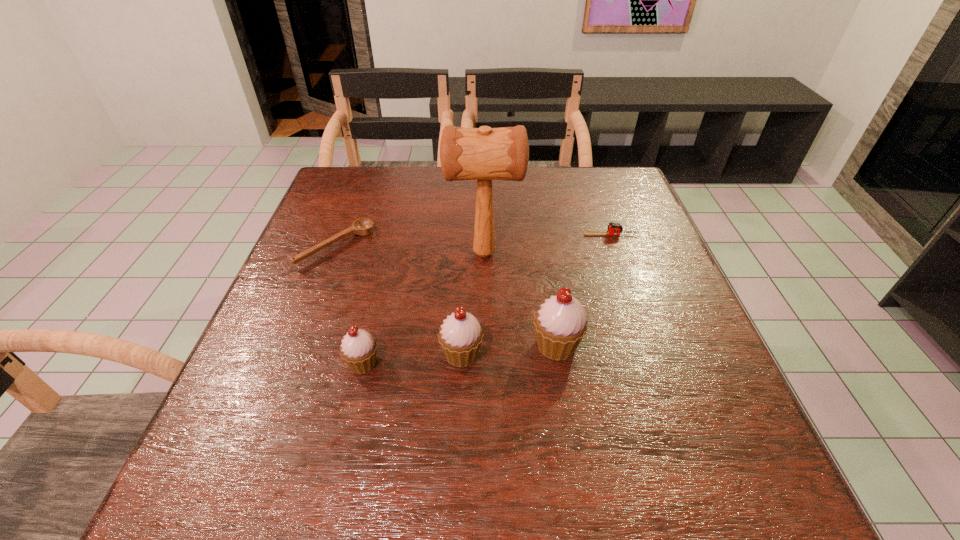
Image resolution: width=960 pixels, height=540 pixels. In order to click on unoccupied area between the tallest cupcake and the wooden spoon in this screenshot , I will do pyautogui.click(x=446, y=296).

Image resolution: width=960 pixels, height=540 pixels. In order to click on free point between the rightmost object and the rightmost cupcake in this screenshot , I will do `click(584, 290)`.

At what (x,y) coordinates should I click in order to perform the action: click on unoccupied area between the tape measure and the second tallest cupcake. Please return your answer as a coordinate pair (x, y). The width and height of the screenshot is (960, 540). Looking at the image, I should click on (537, 294).

You are a GUI agent. You are given a task and a screenshot of the screen. Output one action in this format:
    pyautogui.click(x=<x>, y=<y>)
    Task: Click on the free space between the fifth shortest object and the tape measure
    The height and width of the screenshot is (540, 960).
    Given the screenshot: What is the action you would take?
    pyautogui.click(x=584, y=290)

The height and width of the screenshot is (540, 960). Find the location of `free area in between the second cupcake from right to left and the wooden spoon`. free area in between the second cupcake from right to left and the wooden spoon is located at coordinates (399, 300).

Find the location of a particular element. This screenshot has width=960, height=540. free space between the shortest cupcake and the second tallest cupcake is located at coordinates (412, 359).

Image resolution: width=960 pixels, height=540 pixels. What are the coordinates of `unoccupied position between the shortest cupcake and the second tallest cupcake` in the screenshot? It's located at (412, 359).

Identify which object is the fourth nearest to the second tallest object. Please provide its 2D coordinates. Your answer should be formatted as a tuple, i.e. [(x, y)], where the tuple contains the x and y coordinates of a point satisfying the conditions above.

[(614, 228)]

Identify which object is the second closest to the leftmost cupcake. Please provide its 2D coordinates. Your answer should be formatted as a tuple, i.e. [(x, y)], where the tuple contains the x and y coordinates of a point satisfying the conditions above.

[(364, 226)]

Where is `cupcake that is the third nearest to the leftmost object`? cupcake that is the third nearest to the leftmost object is located at coordinates (560, 324).